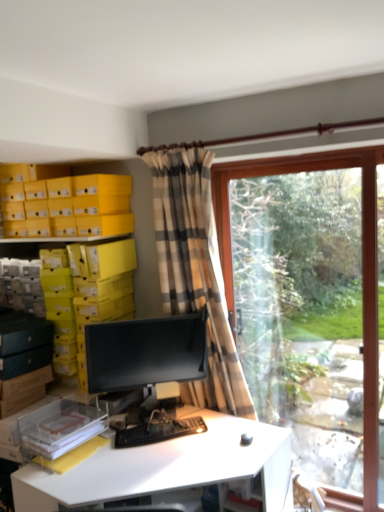
This screenshot has width=384, height=512. What are the coordinates of `free region on the left part of black matte keyboard at center` in the screenshot? It's located at (92, 454).